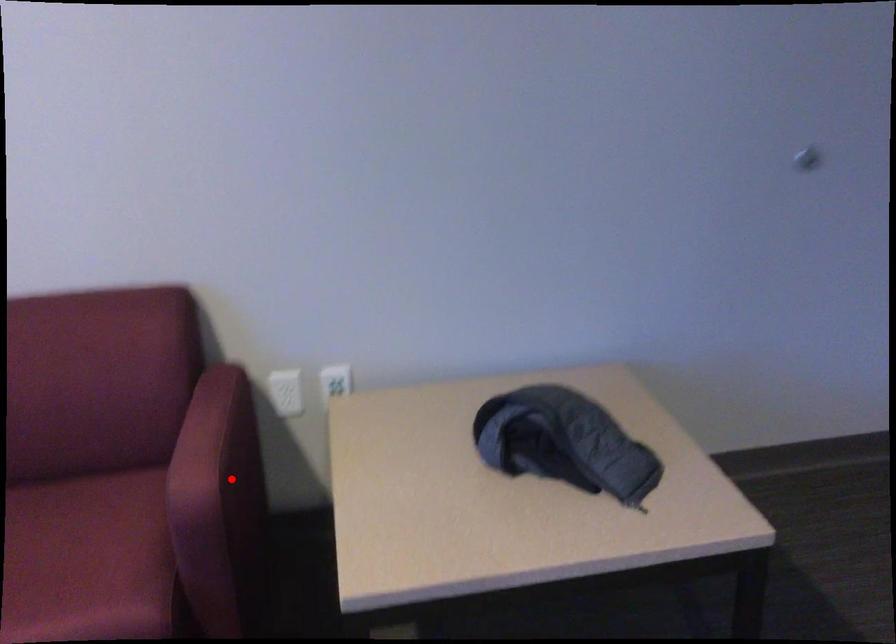
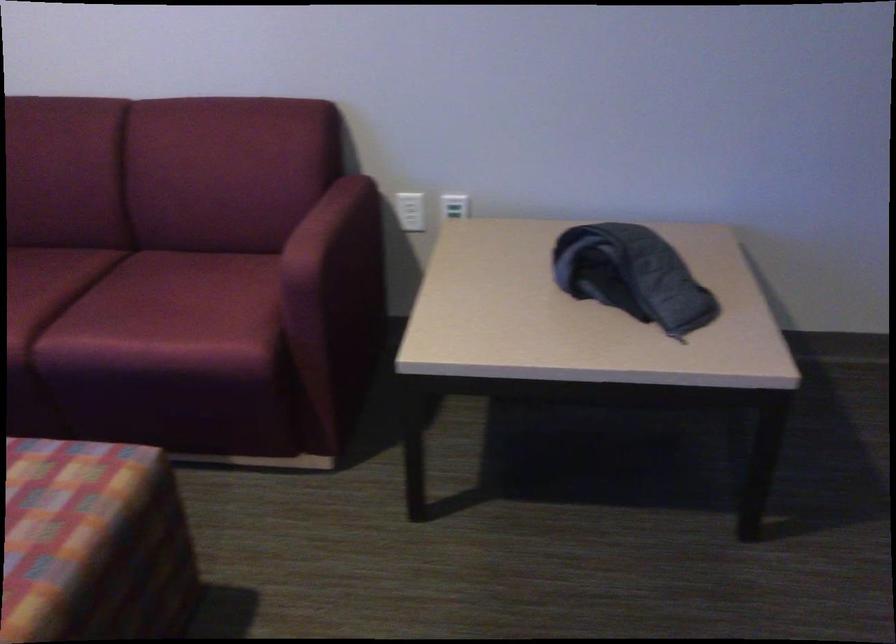
Question: A red point is marked in image1. In image2, is the corresponding 3D point closer to the camera or farther? Reply with the corresponding letter.

Choices:
 (A) The corresponding 3D point is closer.
 (B) The corresponding 3D point is farther.

Answer: (B)